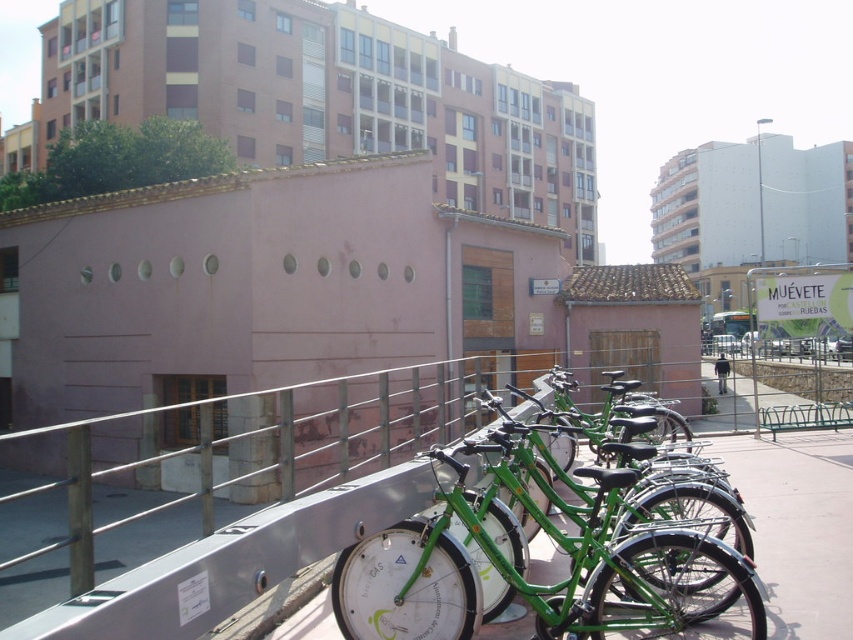
Is green matte bicycle at center thinner than black fabric jacket at center?

Yes, green matte bicycle at center is thinner than black fabric jacket at center.

Is point (422, 548) closer to viewer compared to point (714, 365)?

Yes, point (422, 548) is closer to viewer.

The image size is (853, 640). I want to click on green matte bicycle at center, so click(538, 584).